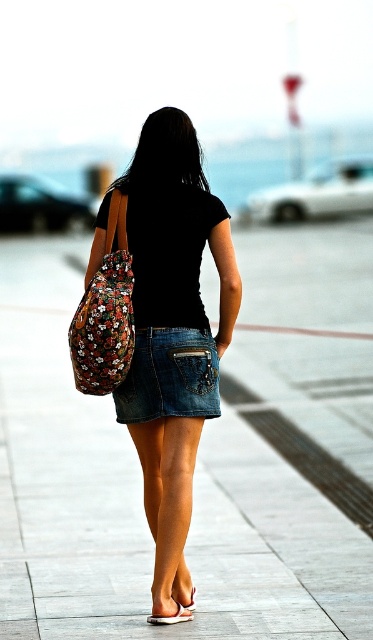
You are a photographer who wants to capture a clear shot of the smooth concrete pavement at center. Given that your camera has a minimum focusing distance of 20 feet, will you need to adjust your position to ensure the pavement is in focus?

The smooth concrete pavement at center is 19.15 feet away from the camera, which is less than the minimum focusing distance of 20 feet. Therefore, you will need to move back to increase the distance to at least 20 feet to ensure the pavement is in focus.

You are a photographer who wants to focus on the person in the image. The camera can only focus on objects located at a specific coordinate. Is the point at coordinate point (170, 253) on the denim skirt at center?

Yes, the point (170, 253) is on the denim skirt at center, as stated in the description.

You are a photographer who wants to adjust your camera settings to focus on the floral fabric bag at center and the white matte heel at lower center. Since the bag is much taller than the heel, which object should you focus on to ensure both are in focus?

Since the floral fabric bag at center is much taller than the white matte heel at lower center, you should focus on the floral fabric bag at center to ensure both are in focus.